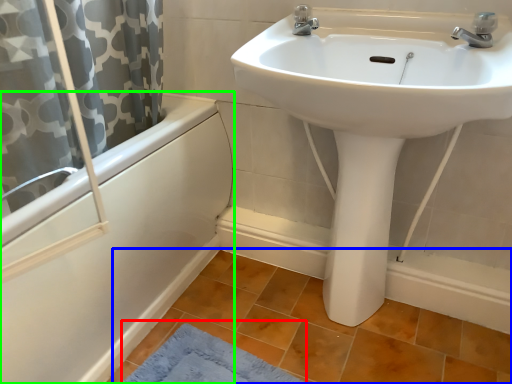
Question: Considering the real-world distances, which object is closest to bath mat (highlighted by a red box)? tile (highlighted by a blue box) or bathtub (highlighted by a green box).

Choices:
 (A) tile
 (B) bathtub

Answer: (A)